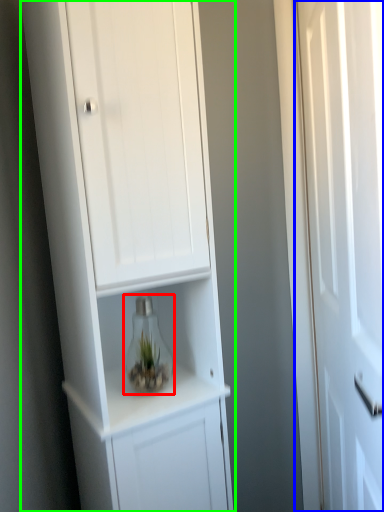
Question: Considering the real-world distances, which object is closest to glass vase (highlighted by a red box)? door (highlighted by a blue box) or cupboard (highlighted by a green box).

Choices:
 (A) door
 (B) cupboard

Answer: (B)